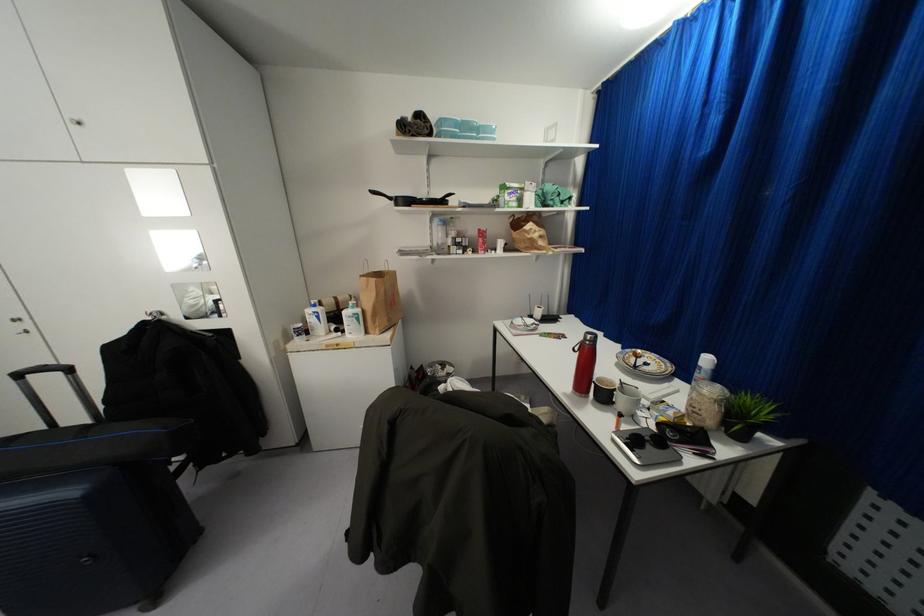
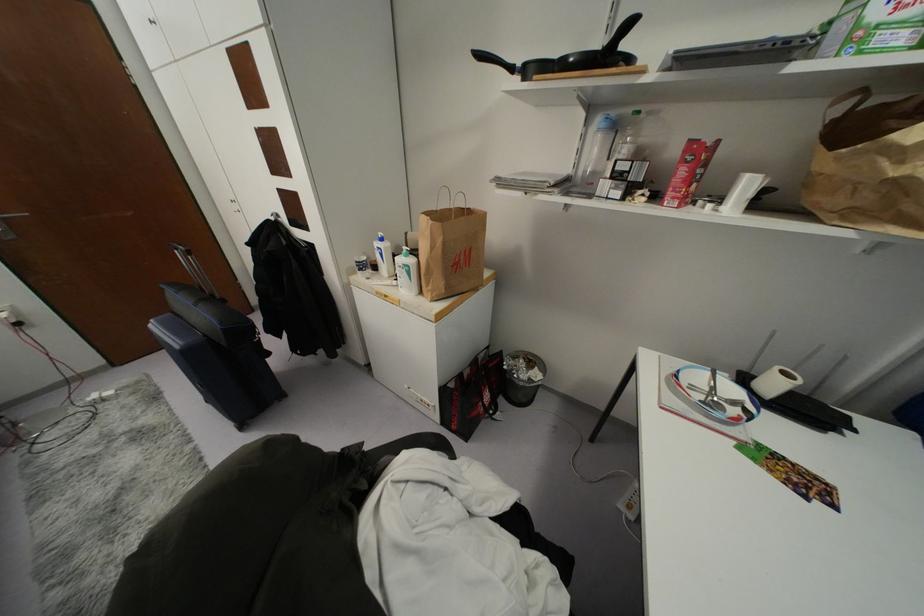
In the second image, find the point that corresponds to point 358,310 in the first image.

(410, 261)